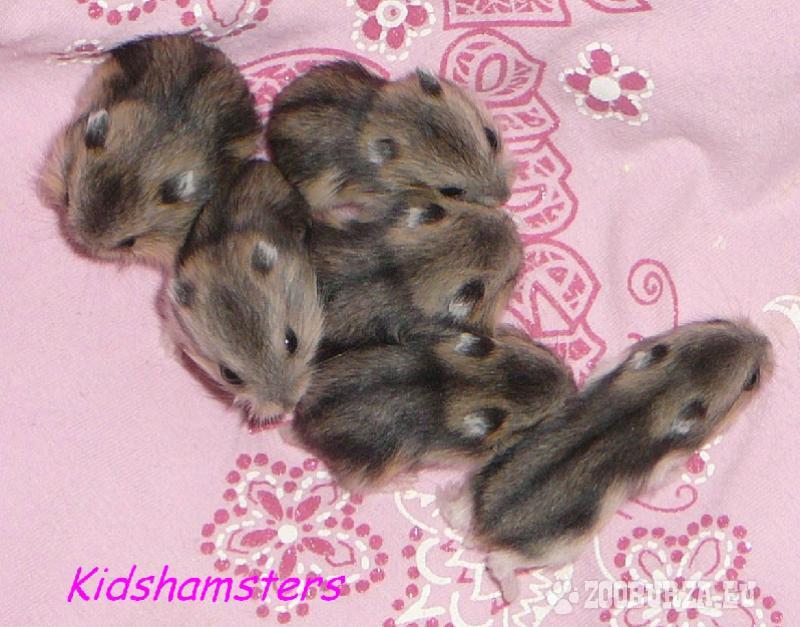
Where is `painted decor`? This screenshot has width=800, height=627. painted decor is located at coordinates (712, 559), (278, 535), (552, 303), (512, 68), (508, 16), (380, 19), (230, 17), (265, 80).